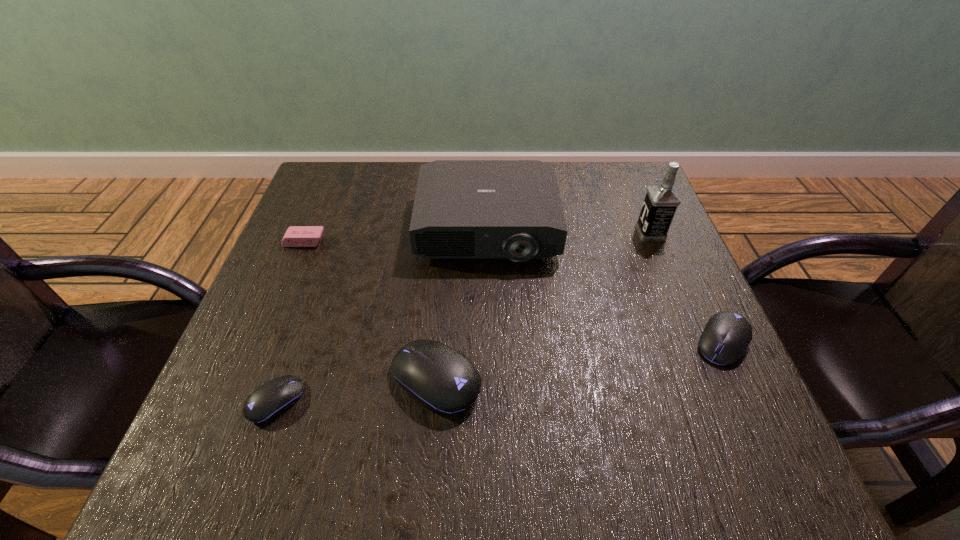
The image size is (960, 540). In order to click on vacant point located between the tallest computer mouse and the shortest computer mouse in this screenshot , I will do `click(356, 390)`.

This screenshot has height=540, width=960. Identify the location of vacant area that lies between the second shortest computer mouse and the eraser. (514, 292).

Locate an element on the screen. The height and width of the screenshot is (540, 960). empty space between the second tallest object and the eraser is located at coordinates (396, 235).

At what (x,y) coordinates should I click in order to perform the action: click on free space between the leftmost computer mouse and the second computer mouse from right to left. Please return your answer as a coordinate pair (x, y). The height and width of the screenshot is (540, 960). Looking at the image, I should click on (356, 390).

I want to click on blank region between the vodka and the projector, so click(x=568, y=231).

This screenshot has width=960, height=540. Find the location of `free spot between the fifth shortest object and the second computer mouse from left to right`. free spot between the fifth shortest object and the second computer mouse from left to right is located at coordinates (462, 304).

The height and width of the screenshot is (540, 960). I want to click on empty space that is in between the leftmost computer mouse and the eraser, so click(x=290, y=321).

Choose which object is the third nearest neighbor to the eraser. Please provide its 2D coordinates. Your answer should be formatted as a tuple, i.e. [(x, y)], where the tuple contains the x and y coordinates of a point satisfying the conditions above.

[(270, 400)]

Select which object appears as the closest to the tallest object. Please provide its 2D coordinates. Your answer should be formatted as a tuple, i.e. [(x, y)], where the tuple contains the x and y coordinates of a point satisfying the conditions above.

[(512, 209)]

Select which computer mouse appears as the third closest to the vodka. Please provide its 2D coordinates. Your answer should be formatted as a tuple, i.e. [(x, y)], where the tuple contains the x and y coordinates of a point satisfying the conditions above.

[(270, 400)]